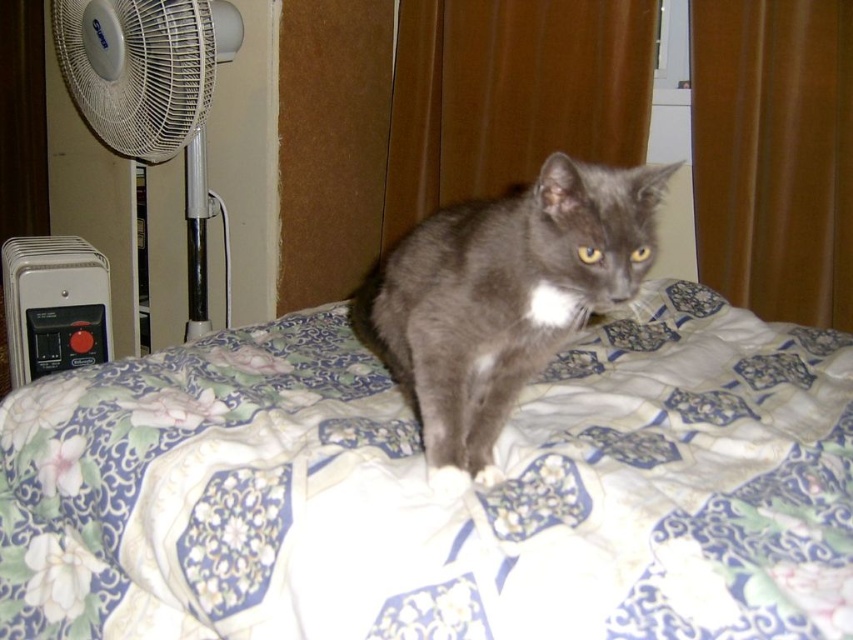
From the picture: Can you confirm if floral-patterned fabric at center is positioned to the left of gray matte fur cat at center?

Incorrect, floral-patterned fabric at center is not on the left side of gray matte fur cat at center.

Who is lower down, floral-patterned fabric at center or gray matte fur cat at center?

floral-patterned fabric at center is below.

Does point (663, 362) come behind point (650, 259)?

Yes, point (663, 362) is behind point (650, 259).

This screenshot has height=640, width=853. I want to click on floral-patterned fabric at center, so click(432, 496).

Where is `white plastic fan at left`? white plastic fan at left is located at coordinates 154,99.

Is white plastic fan at left taller than black plastic thermostat at lower left?

Correct, white plastic fan at left is much taller as black plastic thermostat at lower left.

Is point (175, 106) positioned in front of point (93, 307)?

Yes, point (175, 106) is closer to viewer.

Where is `white plastic fan at left`? white plastic fan at left is located at coordinates (154, 99).

Between gray matte fur cat at center and white plastic radiator at lower left, which one has less height?

gray matte fur cat at center

The width and height of the screenshot is (853, 640). Find the location of `gray matte fur cat at center`. gray matte fur cat at center is located at coordinates (505, 296).